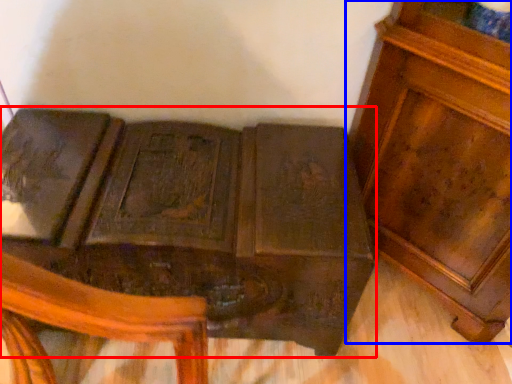
Question: Which point is closer to the camera, furniture (highlighted by a red box) or furniture (highlighted by a blue box)?

Choices:
 (A) furniture
 (B) furniture

Answer: (B)